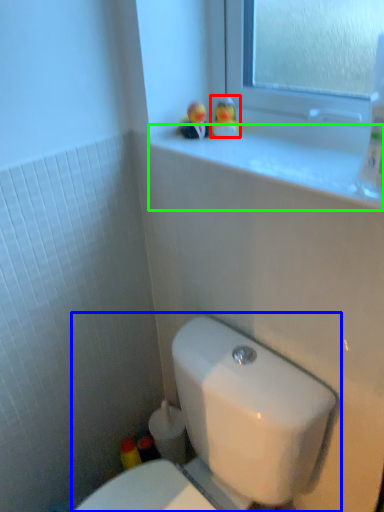
Question: Which object is the farthest from miniature (highlighted by a red box)? Choose among these: toilet (highlighted by a blue box) or window sill (highlighted by a green box).

Choices:
 (A) toilet
 (B) window sill

Answer: (A)